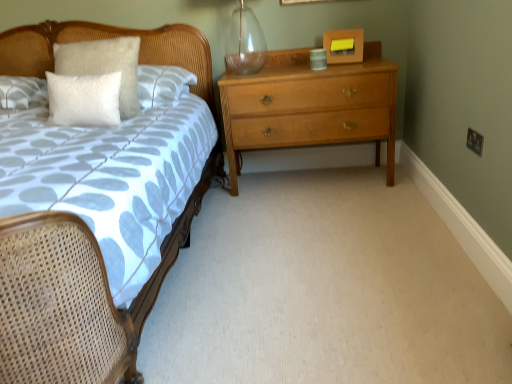
Question: Considering the relative sizes of white textured pillow at upper left and light brown wood chest of drawers at center in the image provided, is white textured pillow at upper left wider than light brown wood chest of drawers at center?

Choices:
 (A) yes
 (B) no

Answer: (B)

Question: Does white textured pillow at upper left come in front of light brown wood chest of drawers at center?

Choices:
 (A) yes
 (B) no

Answer: (A)

Question: Are white textured pillow at upper left and light brown wood chest of drawers at center making contact?

Choices:
 (A) no
 (B) yes

Answer: (A)

Question: From the image's perspective, is white textured pillow at upper left under light brown wood chest of drawers at center?

Choices:
 (A) no
 (B) yes

Answer: (A)

Question: Is white textured pillow at upper left taller than light brown wood chest of drawers at center?

Choices:
 (A) yes
 (B) no

Answer: (B)

Question: Is white textured pillow at upper left to the right of light brown wood chest of drawers at center from the viewer's perspective?

Choices:
 (A) no
 (B) yes

Answer: (A)

Question: Is light brown wood chest of drawers at center surrounding transparent glass vase at upper center?

Choices:
 (A) no
 (B) yes

Answer: (A)

Question: Is light brown wood chest of drawers at center bigger than transparent glass vase at upper center?

Choices:
 (A) no
 (B) yes

Answer: (B)

Question: Is light brown wood chest of drawers at center shorter than transparent glass vase at upper center?

Choices:
 (A) yes
 (B) no

Answer: (B)

Question: Is light brown wood chest of drawers at center positioned beyond the bounds of transparent glass vase at upper center?

Choices:
 (A) no
 (B) yes

Answer: (B)

Question: Does light brown wood chest of drawers at center turn towards transparent glass vase at upper center?

Choices:
 (A) yes
 (B) no

Answer: (B)

Question: Is there a large distance between light brown wood chest of drawers at center and transparent glass vase at upper center?

Choices:
 (A) no
 (B) yes

Answer: (A)

Question: Is transparent glass vase at upper center at the back of wooden bed at left?

Choices:
 (A) no
 (B) yes

Answer: (A)